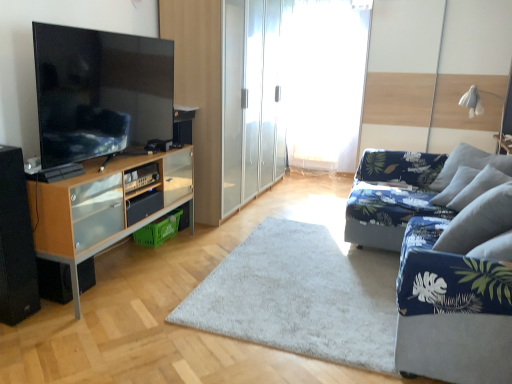
Question: Considering the relative sizes of transparent glass wardrobe at center and black matte speaker at lower left, the 2th speaker when ordered from back to front, in the image provided, is transparent glass wardrobe at center thinner than black matte speaker at lower left, the 2th speaker when ordered from back to front,?

Choices:
 (A) no
 (B) yes

Answer: (A)

Question: Does transparent glass wardrobe at center have a smaller size compared to black matte speaker at lower left, the first speaker when ordered from front to back?

Choices:
 (A) yes
 (B) no

Answer: (B)

Question: From the image's perspective, is transparent glass wardrobe at center below black matte speaker at lower left, the first speaker when ordered from front to back?

Choices:
 (A) yes
 (B) no

Answer: (B)

Question: Is transparent glass wardrobe at center taller than black matte speaker at lower left, the first speaker when ordered from front to back?

Choices:
 (A) yes
 (B) no

Answer: (A)

Question: Can you confirm if transparent glass wardrobe at center is shorter than black matte speaker at lower left, the first speaker when ordered from front to back?

Choices:
 (A) no
 (B) yes

Answer: (A)

Question: Does transparent glass wardrobe at center have a greater width compared to black matte speaker at lower left, the first speaker when ordered from front to back?

Choices:
 (A) no
 (B) yes

Answer: (B)

Question: Is blue fabric couch at right next to black matte speaker at lower left, the 2th speaker when ordered from back to front?

Choices:
 (A) yes
 (B) no

Answer: (B)

Question: Is blue fabric couch at right wider than black matte speaker at lower left, the first speaker when ordered from front to back?

Choices:
 (A) yes
 (B) no

Answer: (A)

Question: Does blue fabric couch at right lie in front of black matte speaker at lower left, the first speaker when ordered from front to back?

Choices:
 (A) yes
 (B) no

Answer: (A)

Question: Is blue fabric couch at right not inside black matte speaker at lower left, the 2th speaker when ordered from back to front?

Choices:
 (A) no
 (B) yes

Answer: (B)

Question: Can you confirm if blue fabric couch at right is smaller than black matte speaker at lower left, the first speaker when ordered from front to back?

Choices:
 (A) yes
 (B) no

Answer: (B)

Question: From the image's perspective, is blue fabric couch at right above black matte speaker at lower left, the 2th speaker when ordered from back to front?

Choices:
 (A) yes
 (B) no

Answer: (B)

Question: Is white sheer curtain at center at the back of transparent glass wardrobe at center?

Choices:
 (A) yes
 (B) no

Answer: (B)